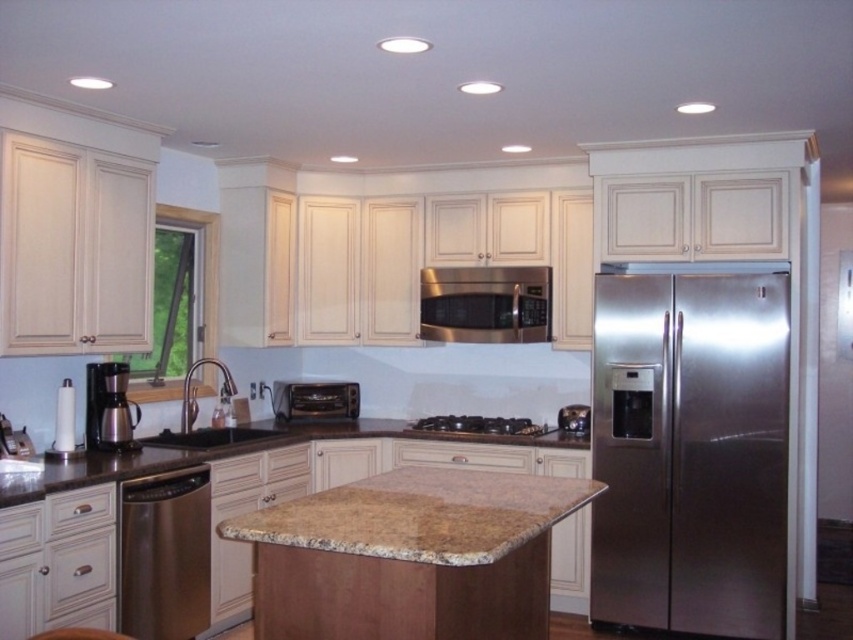
You are a kitchen designer planning to place a new spice rack between the metallic coffee maker at lower left and the stainless steel cooktop at center. According to the current layout, where should the spice rack be placed relative to these two appliances?

The metallic coffee maker at lower left is positioned over the stainless steel cooktop at center, so the spice rack should be placed below the metallic coffee maker at lower left and above the stainless steel cooktop at center to fit between them.

You are organizing the kitchen and need to access both the stainless steel refrigerator at right and the stainless steel dishwasher at lower left. Which appliance is closer to you when facing the kitchen cabinets?

The stainless steel refrigerator at right is closer to you because the stainless steel dishwasher at lower left is positioned behind it.

You are organizing the kitchen and want to place the metallic coffee maker at lower left closer to the sink. Currently, it is to the left of the stainless steel cooktop at center. Is the coffee maker already positioned to the left of the cooktop, or does it need to be moved further left?

The metallic coffee maker at lower left is already positioned on the left side of the stainless steel cooktop at center, so it does not need to be moved further left.